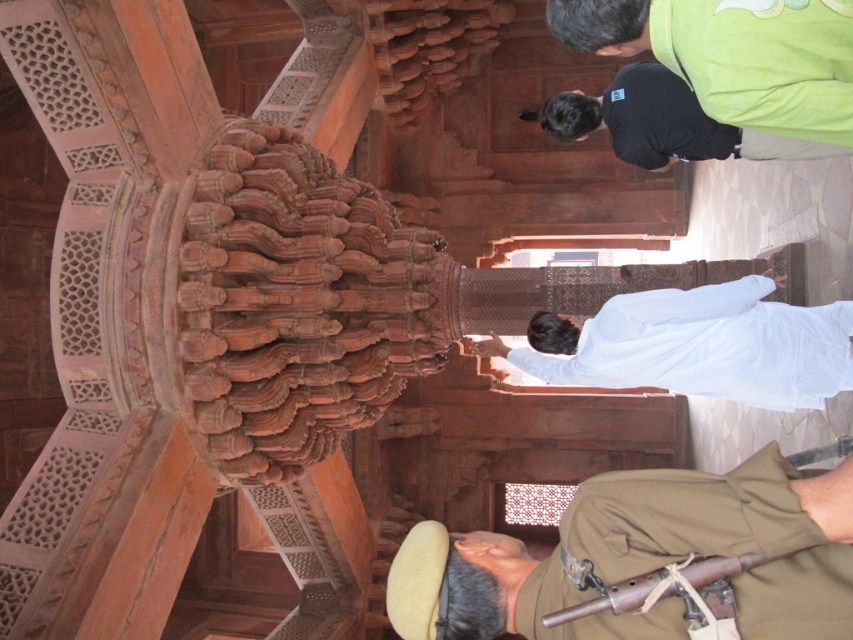
Question: Where is khaki fabric at lower right located in relation to dark green shirt at upper center in the image?

Choices:
 (A) below
 (B) above

Answer: (A)

Question: Which point is farther to the camera?

Choices:
 (A) (676, 506)
 (B) (842, 317)
 (C) (636, 64)

Answer: (C)

Question: Which of these objects is positioned farthest from the white cotton shirt at center?

Choices:
 (A) khaki fabric at lower right
 (B) dark green shirt at upper center

Answer: (B)

Question: In this image, where is khaki fabric at lower right located relative to white cotton shirt at center?

Choices:
 (A) below
 (B) above

Answer: (A)

Question: Is khaki fabric at lower right smaller than dark green shirt at upper center?

Choices:
 (A) yes
 (B) no

Answer: (A)

Question: Estimate the real-world distances between objects in this image. Which object is farther from the khaki fabric at lower right?

Choices:
 (A) white cotton shirt at center
 (B) dark green shirt at upper center

Answer: (B)